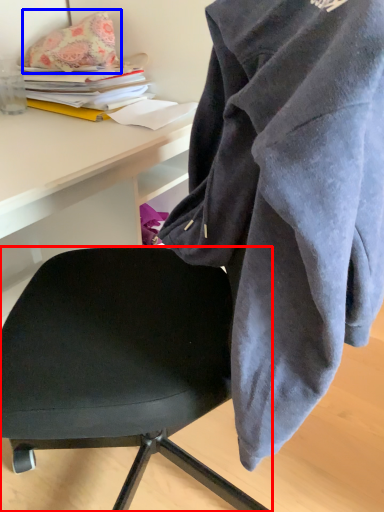
Question: Which object is closer to the camera taking this photo, chair (highlighted by a red box) or pillow (highlighted by a blue box)?

Choices:
 (A) chair
 (B) pillow

Answer: (A)